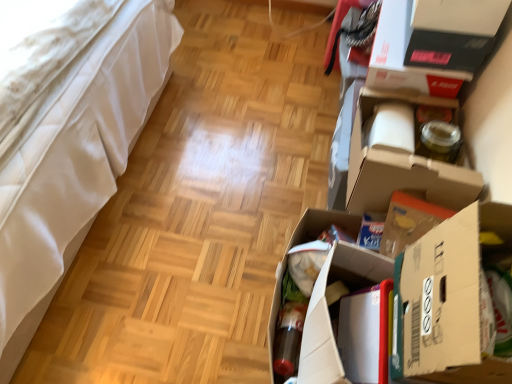
Question: Is white leather bed at left next to white cardboard box at right, the third cardboard box from the back, and touching it?

Choices:
 (A) yes
 (B) no

Answer: (B)

Question: Is white leather bed at left shorter than white cardboard box at right, the third cardboard box from the back?

Choices:
 (A) no
 (B) yes

Answer: (A)

Question: From a real-world perspective, does white leather bed at left stand above white cardboard box at right, the third cardboard box from the back?

Choices:
 (A) no
 (B) yes

Answer: (A)

Question: Is white cardboard box at right, the 1th cardboard box in the front-to-back sequence, at the back of white leather bed at left?

Choices:
 (A) no
 (B) yes

Answer: (A)

Question: Can you confirm if white leather bed at left is positioned to the right of white cardboard box at right, the third cardboard box from the back?

Choices:
 (A) yes
 (B) no

Answer: (B)

Question: In the image, is white leather bed at left positioned in front of or behind white cardboard box at right, the 1th cardboard box in the front-to-back sequence?

Choices:
 (A) front
 (B) behind

Answer: (A)

Question: Considering the positions of white leather bed at left and white cardboard box at right, the third cardboard box from the back, in the image, is white leather bed at left taller or shorter than white cardboard box at right, the third cardboard box from the back,?

Choices:
 (A) tall
 (B) short

Answer: (A)

Question: Considering the positions of white leather bed at left and white cardboard box at right, the third cardboard box from the back, in the image, is white leather bed at left wider or thinner than white cardboard box at right, the third cardboard box from the back,?

Choices:
 (A) thin
 (B) wide

Answer: (B)

Question: In the image, is white leather bed at left on the left side or the right side of white cardboard box at right, the 1th cardboard box in the front-to-back sequence?

Choices:
 (A) right
 (B) left

Answer: (B)

Question: From their relative heights in the image, would you say matte black storage box at upper right is taller or shorter than cardboard box at center, the third cardboard box positioned from the front?

Choices:
 (A) tall
 (B) short

Answer: (B)

Question: Is matte black storage box at upper right inside the boundaries of cardboard box at center, the third cardboard box positioned from the front, or outside?

Choices:
 (A) inside
 (B) outside

Answer: (B)

Question: Is matte black storage box at upper right bigger or smaller than cardboard box at center, which is the 1th cardboard box from back to front?

Choices:
 (A) small
 (B) big

Answer: (A)

Question: From the image's perspective, is matte black storage box at upper right located above or below cardboard box at center, the third cardboard box positioned from the front?

Choices:
 (A) above
 (B) below

Answer: (A)

Question: From the image's perspective, relative to cardboard box at center, the third cardboard box positioned from the front, is white leather bed at left above or below?

Choices:
 (A) above
 (B) below

Answer: (A)

Question: From a real-world perspective, is white leather bed at left above or below cardboard box at center, which is the 1th cardboard box from back to front?

Choices:
 (A) above
 (B) below

Answer: (A)